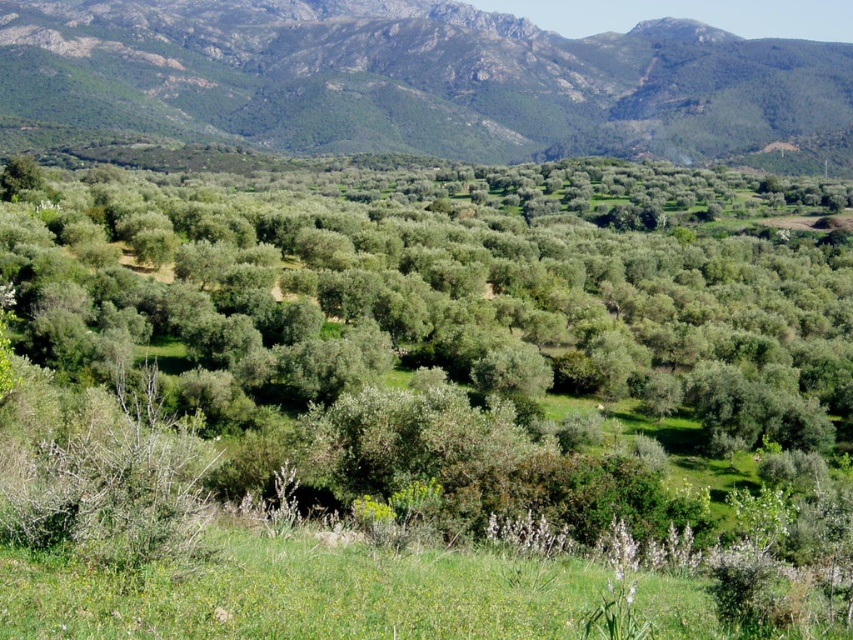
You are a hiker planning to take a photo of the green rocky mountain range at upper center and the green grassy at lower center. Which of the two would appear larger in the photo if you frame them both in your camera?

The green rocky mountain range at upper center would appear larger in the photo because it has a greater height compared to the green grassy at lower center.

You are standing at the base of the olive groves and want to take a photo of the green leafy tree at center and the green grassy at lower center. Which object should you focus on first if you want to capture both in the same frame without moving the camera?

The green leafy tree at center is above the green grassy at lower center, so you should focus on the green grassy at lower center first to ensure both are in the frame without moving the camera.